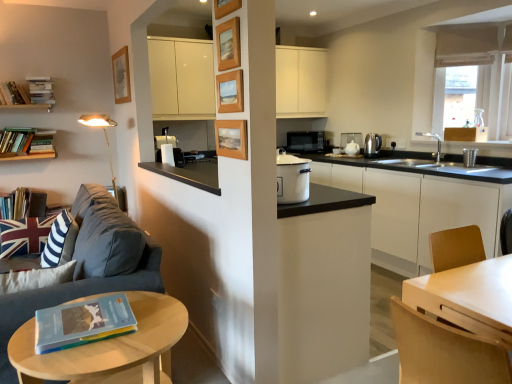
Question: Is hardcover book at lower left, arranged as the 1th book when viewed from the right, positioned behind light wood/woodenobject at lower left?

Choices:
 (A) no
 (B) yes

Answer: (B)

Question: Is hardcover book at lower left, which is counted as the sixth book, starting from the left, aimed at light wood/woodenobject at lower left?

Choices:
 (A) yes
 (B) no

Answer: (B)

Question: Is hardcover book at lower left, the 1th book from the bottom, positioned in front of light wood/woodenobject at lower left?

Choices:
 (A) no
 (B) yes

Answer: (A)

Question: Does hardcover book at lower left, which is counted as the sixth book, starting from the left, have a lesser width compared to light wood/woodenobject at lower left?

Choices:
 (A) yes
 (B) no

Answer: (A)

Question: Does hardcover book at lower left, the first book when ordered from front to back, have a greater height compared to light wood/woodenobject at lower left?

Choices:
 (A) no
 (B) yes

Answer: (A)

Question: From a real-world perspective, does hardcover book at lower left, the first book when ordered from front to back, stand above light wood/woodenobject at lower left?

Choices:
 (A) yes
 (B) no

Answer: (A)

Question: Considering the relative positions of hardcover book at lower left, which is counted as the sixth book, starting from the back, and hardcover book at left, acting as the 3th book starting from the front, in the image provided, is hardcover book at lower left, which is counted as the sixth book, starting from the back, behind hardcover book at left, acting as the 3th book starting from the front,?

Choices:
 (A) yes
 (B) no

Answer: (B)

Question: Are hardcover book at lower left, which is counted as the sixth book, starting from the back, and hardcover book at left, which appears as the fourth book when viewed from the back, far apart?

Choices:
 (A) no
 (B) yes

Answer: (B)

Question: From a real-world perspective, is hardcover book at lower left, which is counted as the sixth book, starting from the left, located higher than hardcover book at left, positioned as the second book in bottom-to-top order?

Choices:
 (A) yes
 (B) no

Answer: (B)

Question: Considering the relative sizes of hardcover book at lower left, the 1th book from the bottom, and hardcover book at left, the fifth book viewed from the right, in the image provided, is hardcover book at lower left, the 1th book from the bottom, wider than hardcover book at left, the fifth book viewed from the right,?

Choices:
 (A) yes
 (B) no

Answer: (A)

Question: Is hardcover book at lower left, arranged as the 1th book when viewed from the right, oriented towards hardcover book at left, which appears as the fourth book when viewed from the back?

Choices:
 (A) yes
 (B) no

Answer: (B)

Question: Considering the relative sizes of hardcover book at lower left, which is counted as the sixth book, starting from the left, and hardcover book at left, positioned as the second book in bottom-to-top order, in the image provided, is hardcover book at lower left, which is counted as the sixth book, starting from the left, taller than hardcover book at left, positioned as the second book in bottom-to-top order,?

Choices:
 (A) no
 (B) yes

Answer: (A)

Question: Considering the relative positions of hardcover book at left, which appears as the fourth book when viewed from the back, and hardcover books at upper left, which is counted as the third book, starting from the right, in the image provided, is hardcover book at left, which appears as the fourth book when viewed from the back, to the left of hardcover books at upper left, which is counted as the third book, starting from the right, from the viewer's perspective?

Choices:
 (A) no
 (B) yes

Answer: (B)